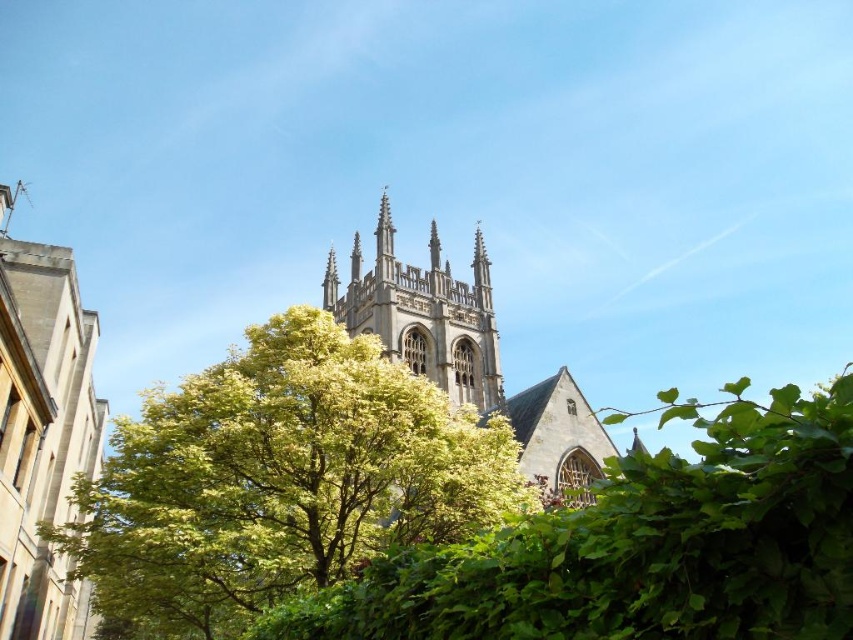
You are standing in a park and see the green leafy tree at center and the stone gothic church at center. Which object appears larger in the image?

The green leafy tree at center appears larger than the stone gothic church at center in the image.

You are a landscape architect assessing the view of this historic building. The green leafy tree at center and the smooth stone spire at center are both visible in the foreground. Which object appears wider in the image?

The green leafy tree at center might be wider than smooth stone spire at center according to the description.

You are standing 40 meters away from the green leafy tree at center. Can you see the pointed arches of the historic Gothic building behind it?

The green leafy tree at center and viewer are 38.72 meters apart, so you are standing closer than 40 meters away. Therefore, you might not have a clear view of the pointed arches of the historic Gothic building behind the tree due to the distance being too close.